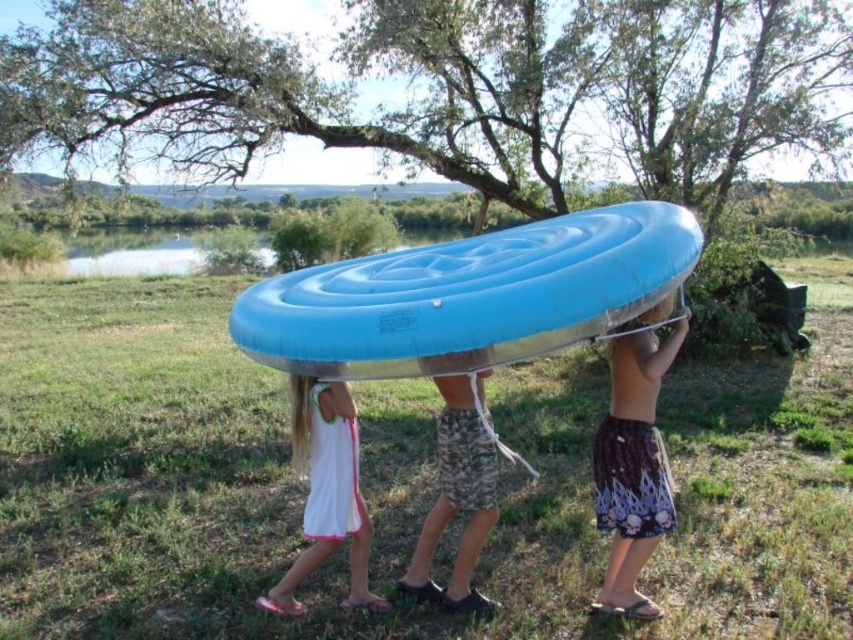
You are a photographer trying to capture the blue rubber raft at center and the printed cotton shorts at center in a single shot. Which object should you focus on first to ensure both are in frame?

The blue rubber raft at center is positioned over printed cotton shorts at center, so you should focus on the blue rubber raft at center first to ensure both are in frame.

You are a photographer trying to capture the scene. The printed cotton shorts at center and the blue rubber boat at center are both in focus. If you want to adjust your camera to focus on the narrower object, which one should you choose?

The printed cotton shorts at center is narrower than the blue rubber boat at center, so you should focus on the printed cotton shorts at center.

You are planning to take a trip on the water and need to choose between the blue rubber raft at center and the blue rubber boat at center. Based on their sizes, which one would you recommend for a group of four people?

The blue rubber raft at center is larger in size compared to the blue rubber boat at center, so it would be more suitable for a group of four people.